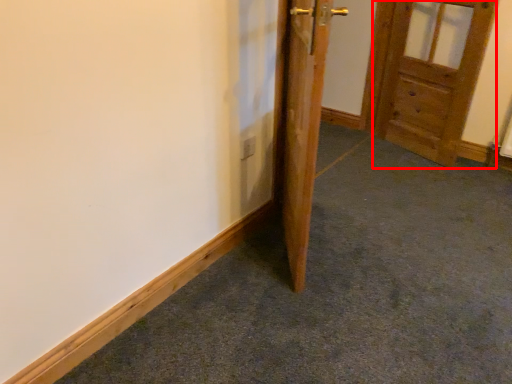
Question: From the image's perspective, where is door (annotated by the red box) located relative to door?

Choices:
 (A) above
 (B) below

Answer: (A)